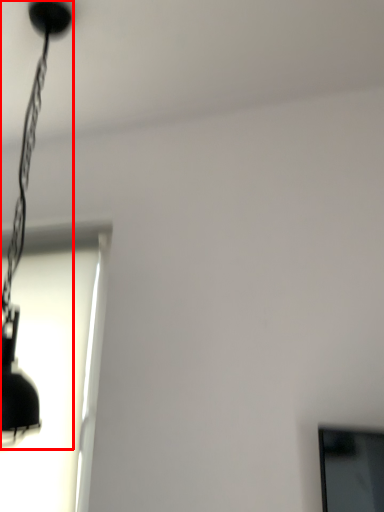
Question: From the image's perspective, what is the correct spatial positioning of lamp (annotated by the red box) in reference to window?

Choices:
 (A) below
 (B) above

Answer: (B)